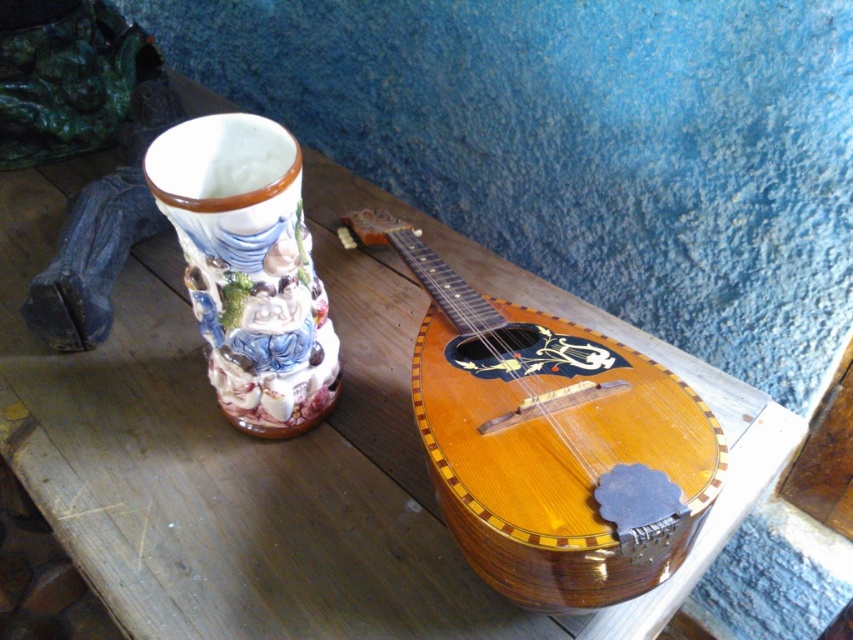
Question: Does wooden banjo at center appear over decorative ceramic vase at left?

Choices:
 (A) no
 (B) yes

Answer: (A)

Question: Can you confirm if wooden banjo at center is smaller than decorative ceramic vase at left?

Choices:
 (A) no
 (B) yes

Answer: (A)

Question: Which of the following is the farthest from the observer?

Choices:
 (A) (483, 474)
 (B) (218, 118)

Answer: (B)

Question: Which object is farther from the camera taking this photo?

Choices:
 (A) decorative ceramic vase at left
 (B) wooden banjo at center

Answer: (A)

Question: Which object appears farthest from the camera in this image?

Choices:
 (A) wooden banjo at center
 (B) decorative ceramic vase at left

Answer: (B)

Question: Does wooden banjo at center appear under decorative ceramic vase at left?

Choices:
 (A) no
 (B) yes

Answer: (B)